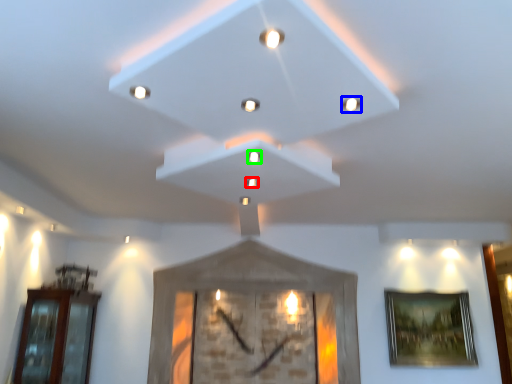
Question: Considering the real-world distances, which object is farthest from light (highlighted by a red box)? light (highlighted by a blue box) or light (highlighted by a green box)?

Choices:
 (A) light
 (B) light

Answer: (A)